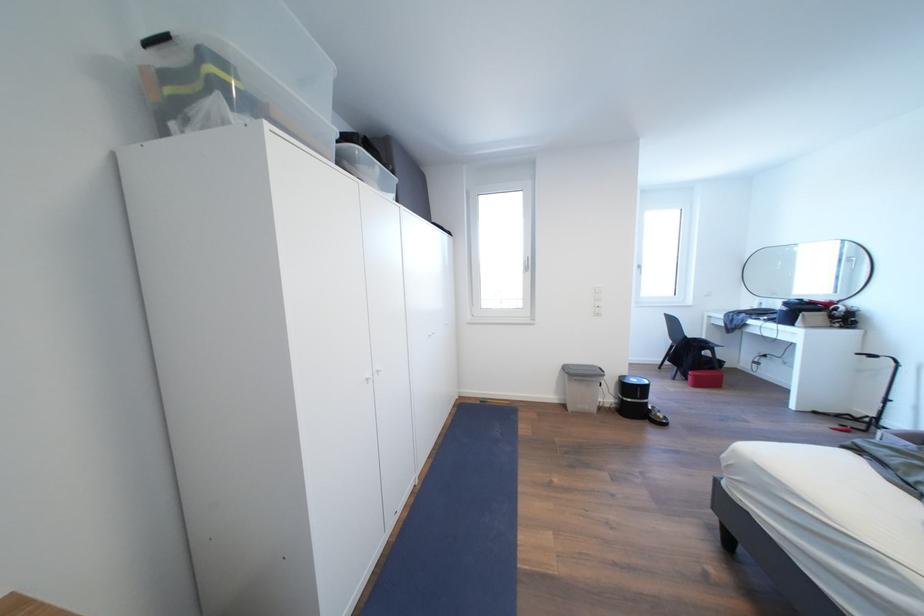
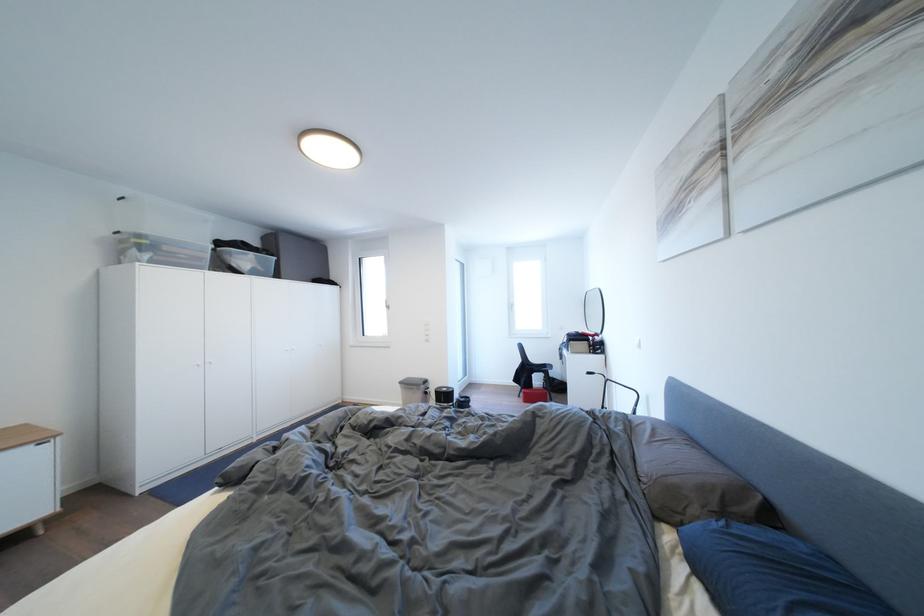
Where in the second image is the point corresponding to the point at 703,381 from the first image?

(532, 398)